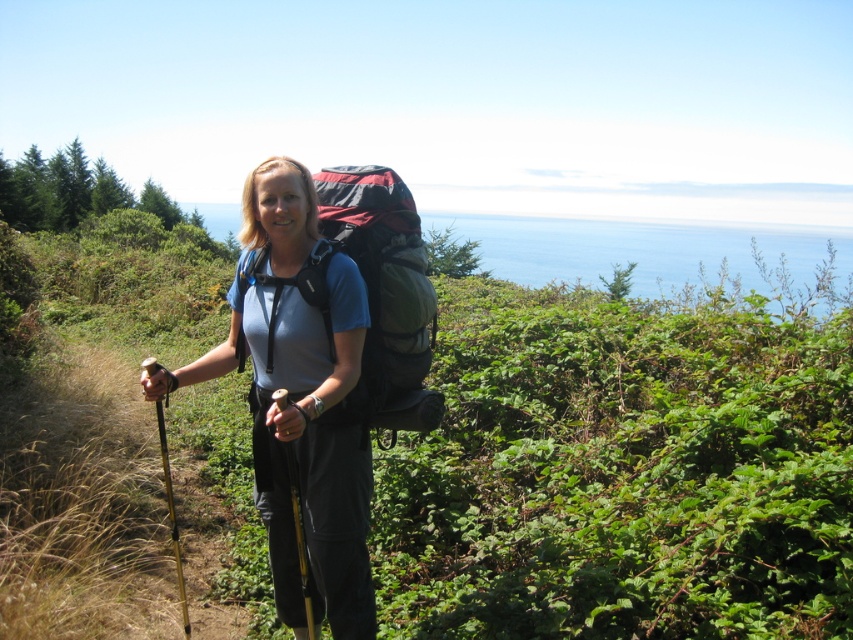
Is matte gray backpack at center to the right of matte black backpack at center from the viewer's perspective?

No, matte gray backpack at center is not to the right of matte black backpack at center.

Is matte gray backpack at center taller than matte black backpack at center?

Yes, matte gray backpack at center is taller than matte black backpack at center.

The height and width of the screenshot is (640, 853). I want to click on matte gray backpack at center, so click(299, 401).

At what (x,y) coordinates should I click in order to perform the action: click on matte gray backpack at center. Please return your answer as a coordinate pair (x, y). Looking at the image, I should click on (299, 401).